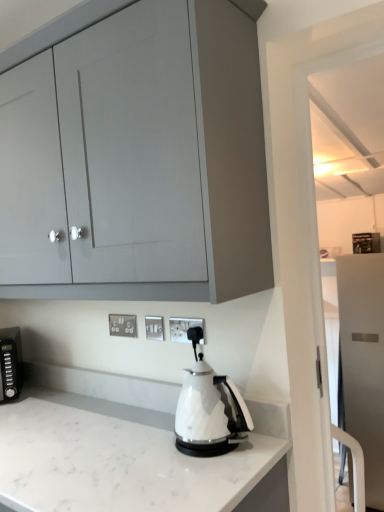
Measure the distance between white plastic electric outlet at center, which appears as the first electric outlet when viewed from the front, and camera.

4.64 feet.

Describe the element at coordinates (154, 327) in the screenshot. I see `white plastic electric outlet at center, placed as the second electric outlet when sorted from back to front` at that location.

Measure the distance between white marble countertop at center and camera.

37.04 inches.

What do you see at coordinates (215, 180) in the screenshot? I see `matte gray cabinet at upper left, arranged as the first cabinetry when viewed from the top` at bounding box center [215, 180].

The height and width of the screenshot is (512, 384). I want to click on white glossy electric kettle at center, so point(209,409).

Does white plastic electric outlet at center, the first electric outlet when ordered from right to left, have a smaller size compared to white marble countertop at center?

Yes.

How many degrees apart are the facing directions of white plastic electric outlet at center, which appears as the first electric outlet when viewed from the front, and white marble countertop at center?

They differ by 0.00895 degrees in their facing directions.

Considering the positions of point (201, 343) and point (6, 503), is point (201, 343) closer or farther from the camera than point (6, 503)?

Point (201, 343).

Locate an element on the screen. the 3rd electric outlet above when counting from the white marble countertop at center (from the image's perspective) is located at coordinates (185, 329).

Which object is further away from the camera taking this photo, white plastic electric outlet at center, the first electric outlet when ordered from right to left, or matte gray cabinet at upper left, the 2th cabinetry when ordered from bottom to top?

white plastic electric outlet at center, the first electric outlet when ordered from right to left, is behind.

Which is behind, point (190, 319) or point (236, 114)?

The point (190, 319) is farther.

Consider the image. Considering the relative sizes of white plastic electric outlet at center, which appears as the first electric outlet when viewed from the front, and matte gray cabinet at upper left, the 2th cabinetry when ordered from back to front, in the image provided, is white plastic electric outlet at center, which appears as the first electric outlet when viewed from the front, wider than matte gray cabinet at upper left, the 2th cabinetry when ordered from back to front,?

Incorrect, the width of white plastic electric outlet at center, which appears as the first electric outlet when viewed from the front, does not surpass that of matte gray cabinet at upper left, the 2th cabinetry when ordered from back to front.

Is silver metallic electrical outlet at center, the first electric outlet in the back-to-front sequence, in front of or behind white marble countertop at center in the image?

silver metallic electrical outlet at center, the first electric outlet in the back-to-front sequence, is behind white marble countertop at center.

Is silver metallic electrical outlet at center, the first electric outlet in the back-to-front sequence, spatially inside white marble countertop at center, or outside of it?

silver metallic electrical outlet at center, the first electric outlet in the back-to-front sequence, is not enclosed by white marble countertop at center.

From the picture: From a real-world perspective, between silver metallic electrical outlet at center, the third electric outlet in the right-to-left sequence, and white marble countertop at center, who is vertically higher?

silver metallic electrical outlet at center, the third electric outlet in the right-to-left sequence.

Visually, is silver metallic electrical outlet at center, the third electric outlet in the right-to-left sequence, positioned to the left or to the right of white marble countertop at center?

Based on their positions, silver metallic electrical outlet at center, the third electric outlet in the right-to-left sequence, is located to the right of white marble countertop at center.

Between point (153, 316) and point (342, 306), which one is positioned in front?

The point (153, 316) is more forward.

You are a GUI agent. You are given a task and a screenshot of the screen. Output one action in this format:
    pyautogui.click(x=<x>, y=<y>)
    Task: Click on the cabinetry behind the white plastic electric outlet at center, the second electric outlet in the left-to-right sequence
    Image resolution: width=384 pixels, height=512 pixels.
    Given the screenshot: What is the action you would take?
    pyautogui.click(x=363, y=361)

Is white plastic electric outlet at center, the second electric outlet viewed from the front, touching satin white refrigerator at right, placed as the second cabinetry when sorted from left to right?

white plastic electric outlet at center, the second electric outlet viewed from the front, and satin white refrigerator at right, placed as the second cabinetry when sorted from left to right, are clearly separated.

How different are the orientations of white plastic electric outlet at center, the second electric outlet viewed from the front, and satin white refrigerator at right, arranged as the 1th cabinetry when ordered from the bottom, in degrees?

The angular difference between white plastic electric outlet at center, the second electric outlet viewed from the front, and satin white refrigerator at right, arranged as the 1th cabinetry when ordered from the bottom, is 0.6 degrees.

Does silver metallic electrical outlet at center, the third electric outlet from the front, lie behind white plastic electric outlet at center, which is the 3th electric outlet in back-to-front order?

Yes, silver metallic electrical outlet at center, the third electric outlet from the front, is further from the camera.

Which of these two, silver metallic electrical outlet at center, the first electric outlet in the back-to-front sequence, or white plastic electric outlet at center, the first electric outlet when ordered from right to left, is bigger?

silver metallic electrical outlet at center, the first electric outlet in the back-to-front sequence.

Between silver metallic electrical outlet at center, the third electric outlet from the front, and white plastic electric outlet at center, which appears as the first electric outlet when viewed from the front, which one appears on the left side from the viewer's perspective?

silver metallic electrical outlet at center, the third electric outlet from the front, is more to the left.

Which of these two, silver metallic electrical outlet at center, the third electric outlet in the right-to-left sequence, or white plastic electric outlet at center, the third electric outlet viewed from the left, is wider?

silver metallic electrical outlet at center, the third electric outlet in the right-to-left sequence.

Which of these two, white plastic electric outlet at center, which appears as the first electric outlet when viewed from the front, or silver metallic electrical outlet at center, the first electric outlet in the back-to-front sequence, is wider?

With larger width is silver metallic electrical outlet at center, the first electric outlet in the back-to-front sequence.

Between white plastic electric outlet at center, the first electric outlet when ordered from right to left, and silver metallic electrical outlet at center, the first electric outlet in the back-to-front sequence, which one has less height?

Standing shorter between the two is silver metallic electrical outlet at center, the first electric outlet in the back-to-front sequence.

What's the angular difference between white plastic electric outlet at center, which is the 3th electric outlet in back-to-front order, and silver metallic electrical outlet at center, the third electric outlet from the front,'s facing directions?

0.00625 degrees.

Could you tell me if white plastic electric outlet at center, which appears as the first electric outlet when viewed from the front, is turned towards silver metallic electrical outlet at center, the third electric outlet from the front?

No, white plastic electric outlet at center, which appears as the first electric outlet when viewed from the front, is not oriented towards silver metallic electrical outlet at center, the third electric outlet from the front.

From a real-world perspective, which object stands above the other?

matte gray cabinet at upper left, the 2th cabinetry when ordered from bottom to top, is physically above.

Looking at this image, does matte gray cabinet at upper left, arranged as the first cabinetry when viewed from the top, have a greater height compared to silver metallic electrical outlet at center, which appears as the 1th electric outlet when viewed from the left?

Correct, matte gray cabinet at upper left, arranged as the first cabinetry when viewed from the top, is much taller as silver metallic electrical outlet at center, which appears as the 1th electric outlet when viewed from the left.

Is matte gray cabinet at upper left, the 2th cabinetry when ordered from back to front, positioned with its back to silver metallic electrical outlet at center, the third electric outlet in the right-to-left sequence?

matte gray cabinet at upper left, the 2th cabinetry when ordered from back to front, does not have its back to silver metallic electrical outlet at center, the third electric outlet in the right-to-left sequence.

Who is more distant, matte gray cabinet at upper left, the 1th cabinetry when ordered from left to right, or silver metallic electrical outlet at center, the third electric outlet in the right-to-left sequence?

silver metallic electrical outlet at center, the third electric outlet in the right-to-left sequence, is further from the camera.

Identify the location of countertop lying in front of the white plastic electric outlet at center, which is the 3th electric outlet in back-to-front order. The width and height of the screenshot is (384, 512). (125, 461).

Where is `electric outlet that is the 3rd object to the right of the matte gray cabinet at upper left, the 2th cabinetry when ordered from bottom to top, starting at the anchor`? This screenshot has width=384, height=512. electric outlet that is the 3rd object to the right of the matte gray cabinet at upper left, the 2th cabinetry when ordered from bottom to top, starting at the anchor is located at coordinates (185, 329).

From the image, which object appears to be nearer to white plastic electric outlet at center, the first electric outlet when ordered from right to left, satin white refrigerator at right, arranged as the 1th cabinetry when ordered from the bottom, or white marble countertop at center?

white marble countertop at center.

Looking at the image, which one is located closer to white marble countertop at center, white glossy electric kettle at center or matte gray cabinet at upper left, the first cabinetry viewed from the front?

white glossy electric kettle at center is closer to white marble countertop at center.

Estimate the real-world distances between objects in this image. Which object is further from white marble countertop at center, satin white refrigerator at right, the second cabinetry viewed from the top, or silver metallic electrical outlet at center, the third electric outlet from the front?

Based on the image, satin white refrigerator at right, the second cabinetry viewed from the top, appears to be further to white marble countertop at center.

From the image, which object appears to be farther from white marble countertop at center, white plastic electric outlet at center, the second electric outlet viewed from the front, or matte gray cabinet at upper left, arranged as the first cabinetry when viewed from the top?

Based on the image, matte gray cabinet at upper left, arranged as the first cabinetry when viewed from the top, appears to be further to white marble countertop at center.

Considering their positions, is matte gray cabinet at upper left, the 2th cabinetry when ordered from bottom to top, positioned further to white marble countertop at center than silver metallic electrical outlet at center, the third electric outlet in the right-to-left sequence?

matte gray cabinet at upper left, the 2th cabinetry when ordered from bottom to top, lies further to white marble countertop at center than the other object.

Considering their positions, is matte gray cabinet at upper left, arranged as the first cabinetry when viewed from the top, positioned further to silver metallic electrical outlet at center, which appears as the 1th electric outlet when viewed from the left, than white marble countertop at center?

Among the two, matte gray cabinet at upper left, arranged as the first cabinetry when viewed from the top, is located further to silver metallic electrical outlet at center, which appears as the 1th electric outlet when viewed from the left.

Considering their positions, is silver metallic electrical outlet at center, the first electric outlet in the back-to-front sequence, positioned closer to satin white refrigerator at right, which is the 1th cabinetry in back-to-front order, than white glossy electric kettle at center?

The object closer to satin white refrigerator at right, which is the 1th cabinetry in back-to-front order, is silver metallic electrical outlet at center, the first electric outlet in the back-to-front sequence.

From the image, which object appears to be farther from white marble countertop at center, silver metallic electrical outlet at center, which appears as the 1th electric outlet when viewed from the left, or white plastic electric outlet at center, which is the 3th electric outlet in back-to-front order?

The object further to white marble countertop at center is silver metallic electrical outlet at center, which appears as the 1th electric outlet when viewed from the left.

The height and width of the screenshot is (512, 384). I want to click on cabinetry between white marble countertop at center and satin white refrigerator at right, which is the second cabinetry from front to back, from front to back, so click(215, 180).

This screenshot has height=512, width=384. Identify the location of kitchen appliance between silver metallic electrical outlet at center, the third electric outlet from the front, and satin white refrigerator at right, placed as the 1th cabinetry when sorted from right to left. (209, 409).

I want to click on kitchen appliance between white marble countertop at center and silver metallic electrical outlet at center, which appears as the 1th electric outlet when viewed from the left, along the z-axis, so click(209, 409).

This screenshot has height=512, width=384. In order to click on electric outlet between white glossy electric kettle at center and white plastic electric outlet at center, the second electric outlet viewed from the front, in the front-back direction in this screenshot , I will do `click(185, 329)`.